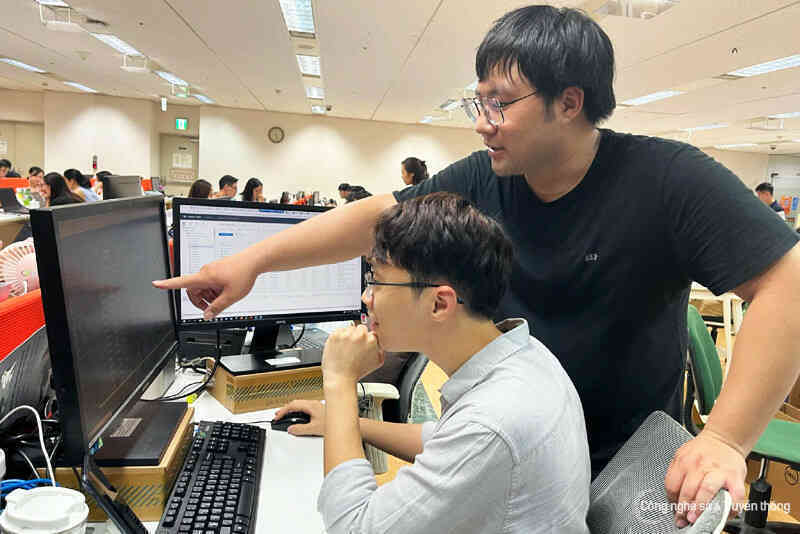
The height and width of the screenshot is (534, 800). What are the coordinates of `chair` in the screenshot? It's located at (630, 482), (713, 366).